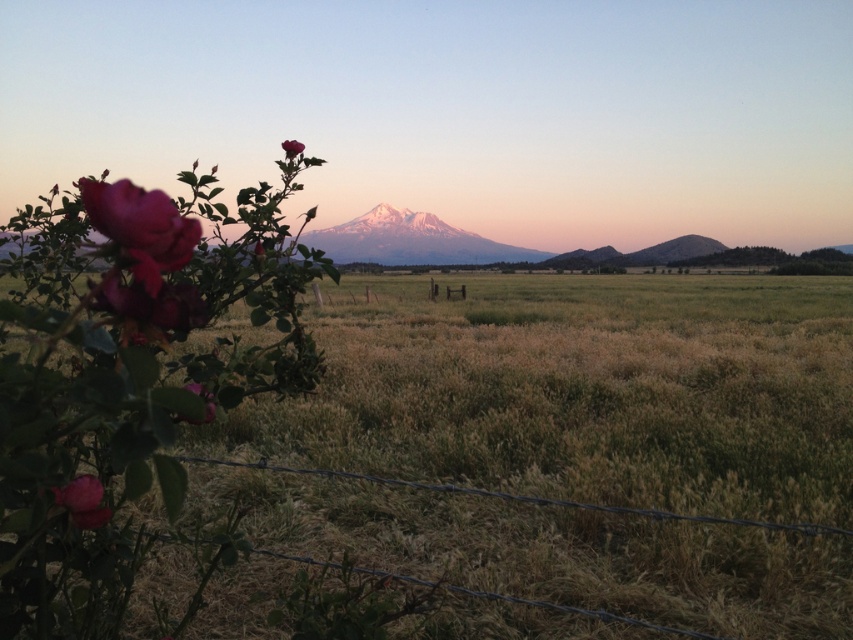
Is grassy field at center above wire/fabric at lower center?

Yes.

Which is below, grassy field at center or wire/fabric at lower center?

wire/fabric at lower center is lower down.

In order to click on grassy field at center in this screenshot , I will do `click(578, 392)`.

Which is below, grassy field at center or matte pink rose at lower left?

matte pink rose at lower left is below.

Looking at this image, can you confirm if grassy field at center is taller than matte pink rose at lower left?

Correct, grassy field at center is much taller as matte pink rose at lower left.

Describe the element at coordinates (578, 392) in the screenshot. This screenshot has width=853, height=640. I see `grassy field at center` at that location.

You are a GUI agent. You are given a task and a screenshot of the screen. Output one action in this format:
    pyautogui.click(x=<x>, y=<y>)
    Task: Click on the grassy field at center
    The image size is (853, 640).
    Given the screenshot: What is the action you would take?
    pyautogui.click(x=578, y=392)

Is grassy field at center taller than matte pink rose at upper center?

Yes, grassy field at center is taller than matte pink rose at upper center.

Is point (685, 504) positioned before point (283, 148)?

No, it is behind (283, 148).

The width and height of the screenshot is (853, 640). I want to click on grassy field at center, so click(578, 392).